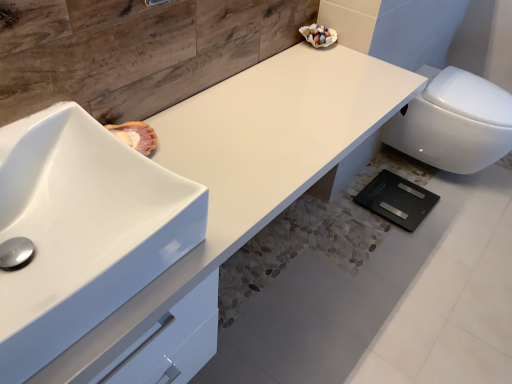
In order to face white glossy sink at left, should I rotate leftwards or rightwards?

To align with it, rotate left about 25.503°.

Identify the location of white glossy sink at left. (62, 211).

What do you see at coordinates (454, 123) in the screenshot? The width and height of the screenshot is (512, 384). I see `white glossy toilet at lower right` at bounding box center [454, 123].

What is the approximate height of white glossy counter top at center?

20.60 inches.

Locate an element on the screen. white glossy counter top at center is located at coordinates (252, 162).

At what (x,y) coordinates should I click in order to perform the action: click on white glossy sink at left. Please return your answer as a coordinate pair (x, y). Image resolution: width=512 pixels, height=384 pixels. Looking at the image, I should click on (62, 211).

Is white glossy counter top at center wider than white glossy toilet at lower right?

No, white glossy counter top at center is not wider than white glossy toilet at lower right.

The width and height of the screenshot is (512, 384). In order to click on counter top in front of the white glossy toilet at lower right in this screenshot , I will do `click(252, 162)`.

Consider the image. Can we say white glossy counter top at center lies outside white glossy toilet at lower right?

Yes, white glossy counter top at center is not within white glossy toilet at lower right.

Is white glossy counter top at center positioned far away from white glossy sink at left?

No, white glossy counter top at center is in close proximity to white glossy sink at left.

Which object is further away from the camera, white glossy counter top at center or white glossy sink at left?

Positioned behind is white glossy counter top at center.

Considering the sizes of white glossy counter top at center and white glossy sink at left in the image, is white glossy counter top at center taller or shorter than white glossy sink at left?

white glossy counter top at center is taller than white glossy sink at left.

What are the coordinates of `sink to the left of white glossy counter top at center` in the screenshot? It's located at (62, 211).

Which object is further away from the camera taking this photo, white glossy sink at left or white glossy counter top at center?

white glossy counter top at center is more distant.

In terms of height, does white glossy sink at left look taller or shorter compared to white glossy counter top at center?

white glossy sink at left is shorter than white glossy counter top at center.

From the image's perspective, between white glossy sink at left and white glossy counter top at center, which one is located above?

white glossy counter top at center, from the image's perspective.

Based on the photo, which is more distant, [63,108] or [286,76]?

The point [286,76] is more distant.

At what (x,y) coordinates should I click in order to perform the action: click on toilet that appears on the right of white glossy sink at left. Please return your answer as a coordinate pair (x, y). This screenshot has height=384, width=512. Looking at the image, I should click on pos(454,123).

Is white glossy toilet at lower right bigger or smaller than white glossy sink at left?

Considering their sizes, white glossy toilet at lower right takes up more space than white glossy sink at left.

Between white glossy toilet at lower right and white glossy sink at left, which one appears on the right side from the viewer's perspective?

Positioned to the right is white glossy toilet at lower right.

Is white glossy toilet at lower right positioned behind white glossy sink at left?

Yes, white glossy toilet at lower right is further from the viewer.

Is white glossy toilet at lower right oriented away from white glossy counter top at center?

No, white glossy toilet at lower right is not facing away from white glossy counter top at center.

Can white glossy counter top at center be found inside white glossy toilet at lower right?

No, white glossy counter top at center is located outside of white glossy toilet at lower right.

Is white glossy toilet at lower right far away from white glossy counter top at center?

That's not correct — white glossy toilet at lower right is a little close to white glossy counter top at center.

Is white glossy sink at left to the left or to the right of white glossy toilet at lower right in the image?

white glossy sink at left is to the left of white glossy toilet at lower right.

You are a GUI agent. You are given a task and a screenshot of the screen. Output one action in this format:
    pyautogui.click(x=<x>, y=<y>)
    Task: Click on the toilet below the white glossy sink at left (from a real-world perspective)
    This screenshot has width=512, height=384.
    Given the screenshot: What is the action you would take?
    pyautogui.click(x=454, y=123)

Is white glossy sink at left inside the boundaries of white glossy toilet at lower right, or outside?

white glossy sink at left is not inside white glossy toilet at lower right, it's outside.

You are a GUI agent. You are given a task and a screenshot of the screen. Output one action in this format:
    pyautogui.click(x=<x>, y=<y>)
    Task: Click on the counter top below the white glossy toilet at lower right (from the image's perspective)
    Image resolution: width=512 pixels, height=384 pixels.
    Given the screenshot: What is the action you would take?
    pyautogui.click(x=252, y=162)

Find the location of a particular element. The image size is (512, 384). counter top below the white glossy sink at left (from a real-world perspective) is located at coordinates (252, 162).

Which object lies further to the anchor point white glossy toilet at lower right, white glossy counter top at center or white glossy sink at left?

Based on the image, white glossy sink at left appears to be further to white glossy toilet at lower right.

Based on their spatial positions, is white glossy toilet at lower right or white glossy sink at left further from white glossy counter top at center?

white glossy toilet at lower right lies further to white glossy counter top at center than the other object.

Which object lies nearer to the anchor point white glossy sink at left, white glossy toilet at lower right or white glossy counter top at center?

white glossy counter top at center lies closer to white glossy sink at left than the other object.

Considering their positions, is white glossy sink at left positioned further to white glossy toilet at lower right than white glossy counter top at center?

white glossy sink at left.

Estimate the real-world distances between objects in this image. Which object is further from white glossy sink at left, white glossy counter top at center or white glossy toilet at lower right?

The object further to white glossy sink at left is white glossy toilet at lower right.

Which object lies further to the anchor point white glossy counter top at center, white glossy sink at left or white glossy toilet at lower right?

white glossy toilet at lower right.

The image size is (512, 384). Identify the location of counter top located between white glossy sink at left and white glossy toilet at lower right in the left-right direction. click(x=252, y=162).